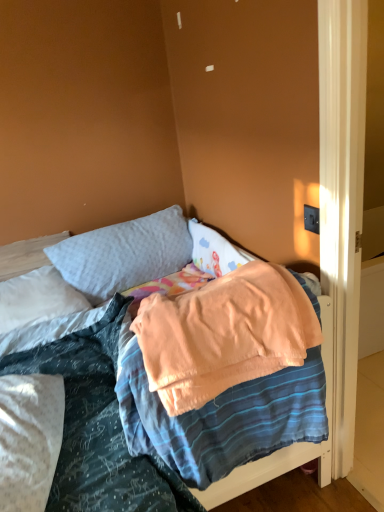
Question: Is white soft pillow at upper left, which appears as the second pillow when viewed from the right, further to the viewer compared to soft gray pillow at upper center, the 1th pillow viewed from the right?

Choices:
 (A) no
 (B) yes

Answer: (A)

Question: Is white soft pillow at upper left, which appears as the first pillow when viewed from the left, looking in the opposite direction of soft gray pillow at upper center, which is the second pillow from left to right?

Choices:
 (A) no
 (B) yes

Answer: (A)

Question: Considering the relative sizes of white soft pillow at upper left, which appears as the first pillow when viewed from the left, and soft gray pillow at upper center, the 1th pillow viewed from the right, in the image provided, is white soft pillow at upper left, which appears as the first pillow when viewed from the left, shorter than soft gray pillow at upper center, the 1th pillow viewed from the right,?

Choices:
 (A) no
 (B) yes

Answer: (B)

Question: From a real-world perspective, is white soft pillow at upper left, which appears as the first pillow when viewed from the left, below soft gray pillow at upper center, which is the second pillow from left to right?

Choices:
 (A) no
 (B) yes

Answer: (B)

Question: From the image's perspective, is white soft pillow at upper left, which appears as the second pillow when viewed from the right, over soft gray pillow at upper center, the 1th pillow viewed from the right?

Choices:
 (A) yes
 (B) no

Answer: (B)

Question: Is white soft pillow at upper left, which appears as the second pillow when viewed from the right, touching soft gray pillow at upper center, the 1th pillow viewed from the right?

Choices:
 (A) yes
 (B) no

Answer: (B)

Question: Can you confirm if soft gray pillow at upper center, which is the second pillow from left to right, is positioned to the right of white soft pillow at upper left, which appears as the first pillow when viewed from the left?

Choices:
 (A) yes
 (B) no

Answer: (A)

Question: From a real-world perspective, is soft gray pillow at upper center, which is the second pillow from left to right, beneath white soft pillow at upper left, which appears as the second pillow when viewed from the right?

Choices:
 (A) no
 (B) yes

Answer: (A)

Question: Considering the relative positions of soft gray pillow at upper center, which is the second pillow from left to right, and white soft pillow at upper left, which appears as the first pillow when viewed from the left, in the image provided, is soft gray pillow at upper center, which is the second pillow from left to right, to the left of white soft pillow at upper left, which appears as the first pillow when viewed from the left, from the viewer's perspective?

Choices:
 (A) yes
 (B) no

Answer: (B)

Question: Does soft gray pillow at upper center, the 1th pillow viewed from the right, come behind white soft pillow at upper left, which appears as the second pillow when viewed from the right?

Choices:
 (A) no
 (B) yes

Answer: (B)

Question: From a real-world perspective, is soft gray pillow at upper center, the 1th pillow viewed from the right, over white soft pillow at upper left, which appears as the second pillow when viewed from the right?

Choices:
 (A) yes
 (B) no

Answer: (A)

Question: Is soft gray pillow at upper center, which is the second pillow from left to right, positioned beyond the bounds of white soft pillow at upper left, which appears as the second pillow when viewed from the right?

Choices:
 (A) yes
 (B) no

Answer: (A)

Question: From a real-world perspective, is white soft pillow at upper left, which appears as the first pillow when viewed from the left, under soft peach blanket at center?

Choices:
 (A) no
 (B) yes

Answer: (B)